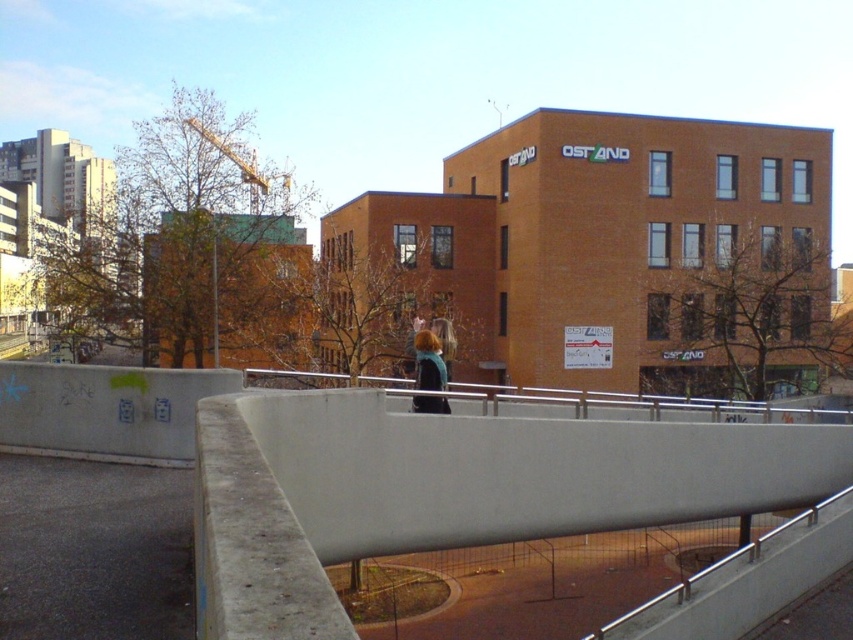
Question: Can you confirm if concrete at center is thinner than blue fabric jacket at center?

Choices:
 (A) yes
 (B) no

Answer: (B)

Question: Which of the following is the farthest from the observer?

Choices:
 (A) blue fabric jacket at center
 (B) concrete at center

Answer: (A)

Question: Among these points, which one is nearest to the camera?

Choices:
 (A) (422, 342)
 (B) (219, 598)

Answer: (B)

Question: Which object is closer to the camera taking this photo?

Choices:
 (A) concrete at center
 (B) blue fabric jacket at center

Answer: (A)

Question: Is concrete at center wider than blue fabric jacket at center?

Choices:
 (A) yes
 (B) no

Answer: (A)

Question: Can you confirm if concrete at center is thinner than blue fabric jacket at center?

Choices:
 (A) yes
 (B) no

Answer: (B)